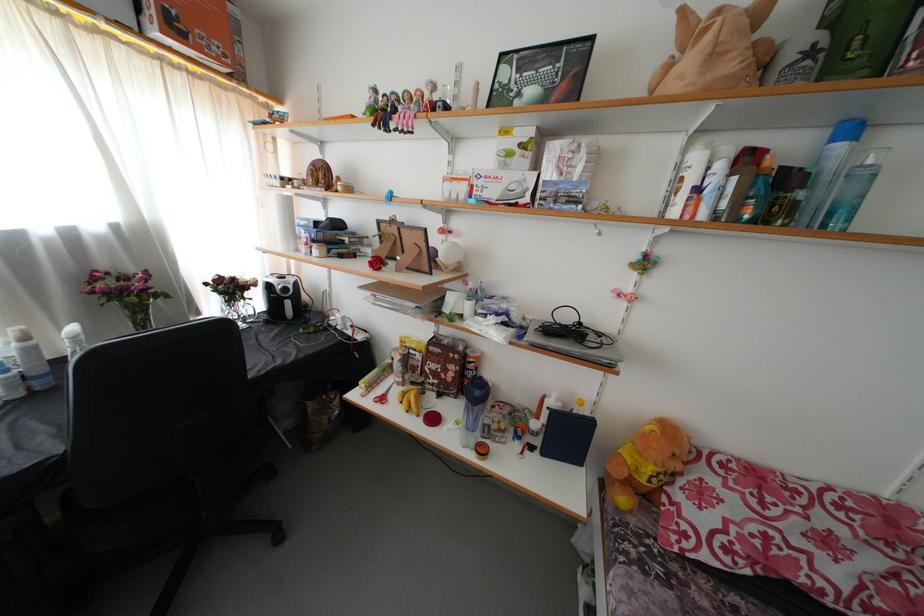
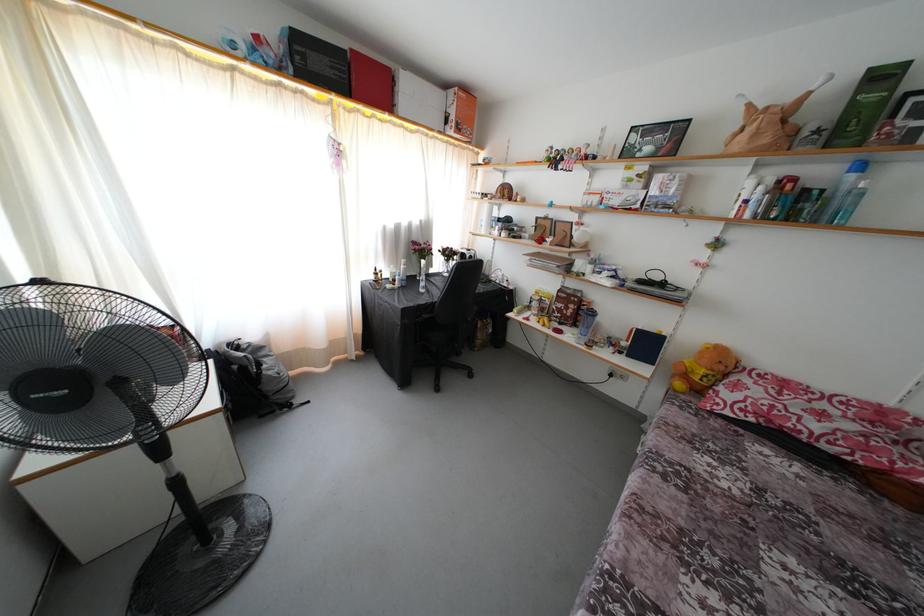
In the second image, find the point that corresponds to [180,34] in the first image.

(463, 134)